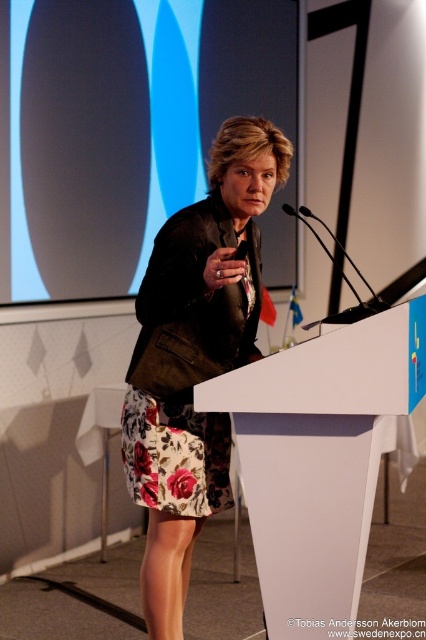
You are a stagehand setting up for a presentation. You need to adjust the microphone stand so it is positioned in front of the floral skirt at center but behind the white plastic podium at center. Is this possible given their current arrangement?

The white plastic podium at center is already behind the floral skirt at center, so the microphone stand cannot be placed in front of the floral skirt at center and behind the white plastic podium at center simultaneously because their positions are fixed in that order.

You are a photographer at the event and want to capture a closeup of both the point at coordinates (169, 273) and the point at coordinates (313, 419). Since you can only focus on one point at a time, which point should you focus on to ensure the other remains in the background?

You should focus on point (169, 273) because it is closer to the viewer than point (313, 419). This way, the farther point will naturally be in the background.

You are an event planner setting up a camera to capture the speaker and the flags. The camera is positioned at the point with coordinates point (195, 356). Where is the floral skirt at center in relation to the camera?

The point (195, 356) corresponds to the floral skirt at center, so the camera is positioned directly at the floral skirt at center.